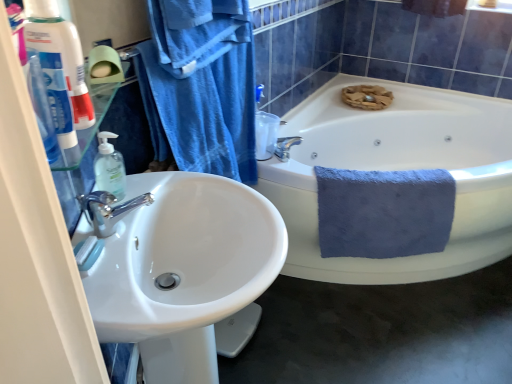
You are a GUI agent. You are given a task and a screenshot of the screen. Output one action in this format:
    pyautogui.click(x=<x>, y=<y>)
    Task: Click on the clear plastic soap dispenser at left
    The image size is (512, 384).
    Given the screenshot: What is the action you would take?
    pyautogui.click(x=109, y=167)

Image resolution: width=512 pixels, height=384 pixels. What do you see at coordinates (109, 167) in the screenshot?
I see `clear plastic soap dispenser at left` at bounding box center [109, 167].

This screenshot has height=384, width=512. What do you see at coordinates (201, 86) in the screenshot?
I see `blue cotton towel at upper left, arranged as the first bath towel when viewed from the left` at bounding box center [201, 86].

The width and height of the screenshot is (512, 384). Describe the element at coordinates (398, 169) in the screenshot. I see `white ceramic bathtub at center` at that location.

Find the location of a particular element. clear plastic soap dispenser at left is located at coordinates (109, 167).

From the image's perspective, between clear plastic soap dispenser at left and white ceramic bathtub at center, who is located below?

clear plastic soap dispenser at left appears lower in the image.

From a real-world perspective, is clear plastic soap dispenser at left positioned above or below white ceramic bathtub at center?

From a real-world perspective, clear plastic soap dispenser at left is physically above white ceramic bathtub at center.

Is point (117, 189) positioned in front of point (465, 117)?

Yes, point (117, 189) is closer to viewer.

Is white ceramic bathtub at center completely or partially inside clear plastic soap dispenser at left?

No, white ceramic bathtub at center is not surrounded by clear plastic soap dispenser at left.

How different are the orientations of white ceramic bathtub at center and blue fluffy towel at right, which is the 1th bath towel from right to left, in degrees?

There is a 28.5-degree angle between the facing directions of white ceramic bathtub at center and blue fluffy towel at right, which is the 1th bath towel from right to left.

From a real-world perspective, between white ceramic bathtub at center and blue fluffy towel at right, placed as the 1th bath towel when sorted from back to front, who is vertically higher?

blue fluffy towel at right, placed as the 1th bath towel when sorted from back to front.

Would you say white ceramic bathtub at center is a long distance from blue fluffy towel at right, placed as the 1th bath towel when sorted from back to front?

No, white ceramic bathtub at center is in close proximity to blue fluffy towel at right, placed as the 1th bath towel when sorted from back to front.

Is white ceramic bathtub at center taller or shorter than blue fluffy towel at right, which is the 1th bath towel from right to left?

Clearly, white ceramic bathtub at center is taller compared to blue fluffy towel at right, which is the 1th bath towel from right to left.

From the image's perspective, is white glossy sink at left beneath blue fluffy towel at right, placed as the 1th bath towel when sorted from back to front?

Correct, white glossy sink at left appears lower than blue fluffy towel at right, placed as the 1th bath towel when sorted from back to front, in the image.

Visually, is white glossy sink at left positioned to the left or to the right of blue fluffy towel at right, which is the 1th bath towel from right to left?

white glossy sink at left is positioned on blue fluffy towel at right, which is the 1th bath towel from right to left,'s left side.

Measure the distance from white glossy sink at left to blue fluffy towel at right, which is the 1th bath towel from right to left.

They are 32.25 inches apart.

From a real-world perspective, relative to blue fluffy towel at right, placed as the 1th bath towel when sorted from back to front, is white glossy sink at left vertically above or below?

Clearly, from a real-world perspective, white glossy sink at left is above blue fluffy towel at right, placed as the 1th bath towel when sorted from back to front.

In terms of width, does white ceramic bathtub at center look wider or thinner when compared to clear plastic soap dispenser at left?

white ceramic bathtub at center is wider than clear plastic soap dispenser at left.

From a real-world perspective, is white ceramic bathtub at center physically located above or below clear plastic soap dispenser at left?

Clearly, from a real-world perspective, white ceramic bathtub at center is below clear plastic soap dispenser at left.

Which of these two, white ceramic bathtub at center or clear plastic soap dispenser at left, is smaller?

Smaller between the two is clear plastic soap dispenser at left.

Considering the positions of point (383, 278) and point (104, 179), is point (383, 278) closer or farther from the camera than point (104, 179)?

Point (383, 278) appears to be farther away from the viewer than point (104, 179).

Which of these two, blue fluffy towel at right, marked as the 2th bath towel in a front-to-back arrangement, or blue cotton towel at upper left, the 2th bath towel viewed from the back, is bigger?

Bigger between the two is blue fluffy towel at right, marked as the 2th bath towel in a front-to-back arrangement.

Which is more to the left, blue fluffy towel at right, placed as the 1th bath towel when sorted from back to front, or blue cotton towel at upper left, the 2th bath towel viewed from the back?

From the viewer's perspective, blue cotton towel at upper left, the 2th bath towel viewed from the back, appears more on the left side.

In the scene shown: Are blue fluffy towel at right, placed as the 1th bath towel when sorted from back to front, and blue cotton towel at upper left, the 2th bath towel viewed from the back, far apart?

No, blue fluffy towel at right, placed as the 1th bath towel when sorted from back to front, is in close proximity to blue cotton towel at upper left, the 2th bath towel viewed from the back.

Is the depth of white glossy sink at left greater than that of white glossy toothpaste tube at left?

Yes, it is.

From the image's perspective, which object appears higher, white glossy sink at left or white glossy toothpaste tube at left?

From the image's view, white glossy toothpaste tube at left is above.

Who is taller, white glossy sink at left or white glossy toothpaste tube at left?

white glossy sink at left is taller.

From a real-world perspective, which is physically above, white glossy sink at left or white glossy toothpaste tube at left?

In real-world perspective, white glossy toothpaste tube at left is above.

Is clear plastic soap dispenser at left oriented away from blue fluffy towel at right, which is the 1th bath towel from right to left?

That's not correct — clear plastic soap dispenser at left is not looking away from blue fluffy towel at right, which is the 1th bath towel from right to left.

From the image's perspective, which one is positioned lower, clear plastic soap dispenser at left or blue fluffy towel at right, marked as the 2th bath towel in a front-to-back arrangement?

blue fluffy towel at right, marked as the 2th bath towel in a front-to-back arrangement, from the image's perspective.

Considering the sizes of objects clear plastic soap dispenser at left and blue fluffy towel at right, which is the 1th bath towel from right to left, in the image provided, who is bigger, clear plastic soap dispenser at left or blue fluffy towel at right, which is the 1th bath towel from right to left,?

With larger size is blue fluffy towel at right, which is the 1th bath towel from right to left.

How much distance is there between clear plastic soap dispenser at left and blue fluffy towel at right, placed as the 2th bath towel when sorted from left to right?

They are 1.05 meters apart.

This screenshot has height=384, width=512. What are the coordinates of `bathtub behind the clear plastic soap dispenser at left` in the screenshot? It's located at (398, 169).

Find the location of a particular element. The height and width of the screenshot is (384, 512). bath towel below the white ceramic bathtub at center (from the image's perspective) is located at coordinates (384, 212).

When comparing their distances from white glossy sink at left, does clear plastic soap dispenser at left or white ceramic bathtub at center seem closer?

clear plastic soap dispenser at left is positioned closer to the anchor white glossy sink at left.

Estimate the real-world distances between objects in this image. Which object is further from blue fluffy towel at right, marked as the 2th bath towel in a front-to-back arrangement, white ceramic bathtub at center or clear plastic soap dispenser at left?

Based on the image, clear plastic soap dispenser at left appears to be further to blue fluffy towel at right, marked as the 2th bath towel in a front-to-back arrangement.

Based on the photo, based on their spatial positions, is clear plastic soap dispenser at left or blue fluffy towel at right, placed as the 1th bath towel when sorted from back to front, closer to white glossy toothpaste tube at left?

clear plastic soap dispenser at left is closer to white glossy toothpaste tube at left.

In the scene shown: Which object lies further to the anchor point clear plastic soap dispenser at left, white ceramic bathtub at center or white glossy toothpaste tube at left?

white ceramic bathtub at center lies further to clear plastic soap dispenser at left than the other object.

Looking at the image, which one is located closer to clear plastic soap dispenser at left, blue fluffy towel at right, marked as the 2th bath towel in a front-to-back arrangement, or blue cotton towel at upper left, the 2th bath towel viewed from the back?

The object closer to clear plastic soap dispenser at left is blue cotton towel at upper left, the 2th bath towel viewed from the back.

Based on their spatial positions, is blue fluffy towel at right, placed as the 2th bath towel when sorted from left to right, or blue cotton towel at upper left, arranged as the first bath towel when viewed from the left, further from white ceramic bathtub at center?

The object further to white ceramic bathtub at center is blue cotton towel at upper left, arranged as the first bath towel when viewed from the left.

Looking at the image, which one is located further to white ceramic bathtub at center, white glossy toothpaste tube at left or clear plastic soap dispenser at left?

The object further to white ceramic bathtub at center is white glossy toothpaste tube at left.

Looking at the image, which one is located closer to clear plastic soap dispenser at left, white ceramic bathtub at center or blue cotton towel at upper left, the 1th bath towel in the front-to-back sequence?

blue cotton towel at upper left, the 1th bath towel in the front-to-back sequence.

Where is `soap dispenser between white glossy sink at left and blue fluffy towel at right, which is the 1th bath towel from right to left, in the front-back direction`? The height and width of the screenshot is (384, 512). soap dispenser between white glossy sink at left and blue fluffy towel at right, which is the 1th bath towel from right to left, in the front-back direction is located at coordinates (109, 167).

Image resolution: width=512 pixels, height=384 pixels. I want to click on sink between clear plastic soap dispenser at left and white ceramic bathtub at center from left to right, so click(x=183, y=270).

You are a GUI agent. You are given a task and a screenshot of the screen. Output one action in this format:
    pyautogui.click(x=<x>, y=<y>)
    Task: Click on the sink located between white glossy toothpaste tube at left and blue fluffy towel at right, placed as the 2th bath towel when sorted from left to right, in the depth direction
    This screenshot has height=384, width=512.
    Given the screenshot: What is the action you would take?
    click(x=183, y=270)

You are a GUI agent. You are given a task and a screenshot of the screen. Output one action in this format:
    pyautogui.click(x=<x>, y=<y>)
    Task: Click on the toiletry between blue cotton towel at upper left, the 2th bath towel viewed from the back, and white glossy sink at left from top to bottom
    Image resolution: width=512 pixels, height=384 pixels.
    Given the screenshot: What is the action you would take?
    point(61,53)